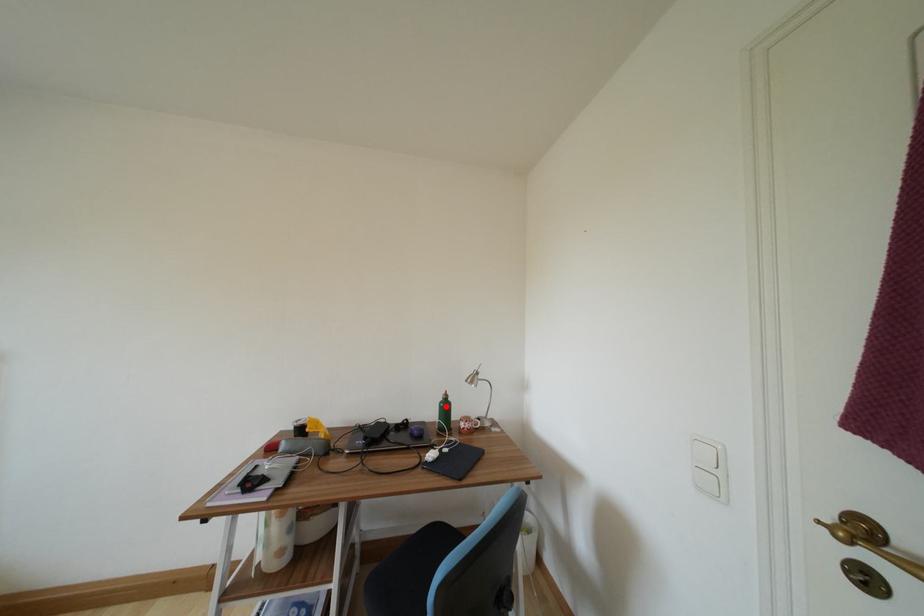
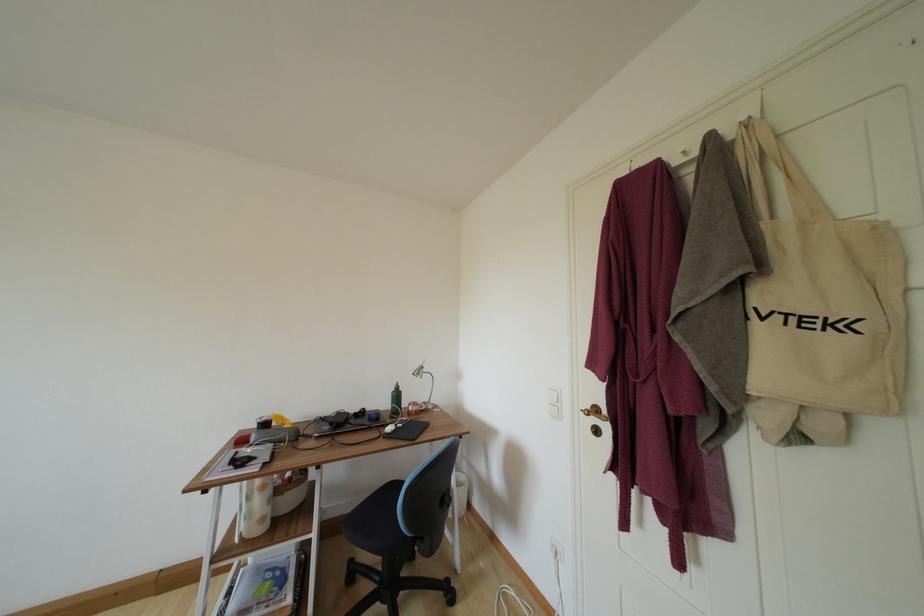
Where in the second image is the point corresponding to the highlighted location from the first image?

(398, 395)